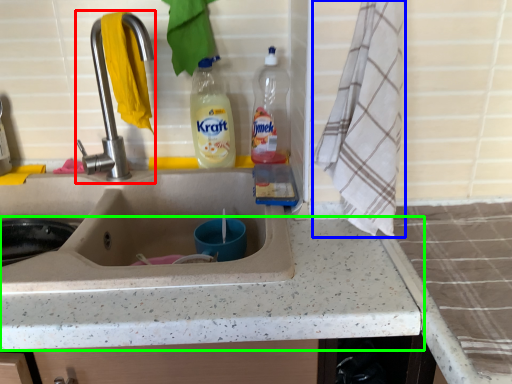
Question: Considering the real-world distances, which object is farthest from tap (highlighted by a red box)? bath towel (highlighted by a blue box) or countertop (highlighted by a green box)?

Choices:
 (A) bath towel
 (B) countertop

Answer: (B)